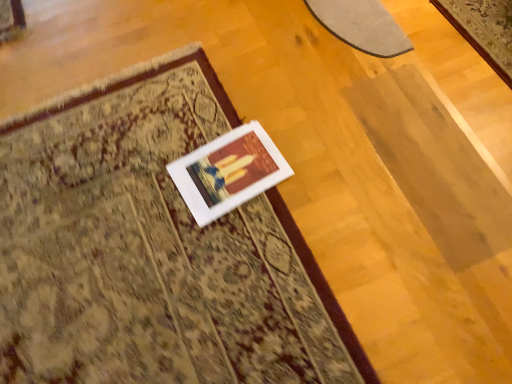
Locate an element on the screen. This screenshot has height=384, width=512. blank space situated above matte gray rug at upper right, marked as the first mat in a right-to-left arrangement (from a real-world perspective) is located at coordinates (355, 14).